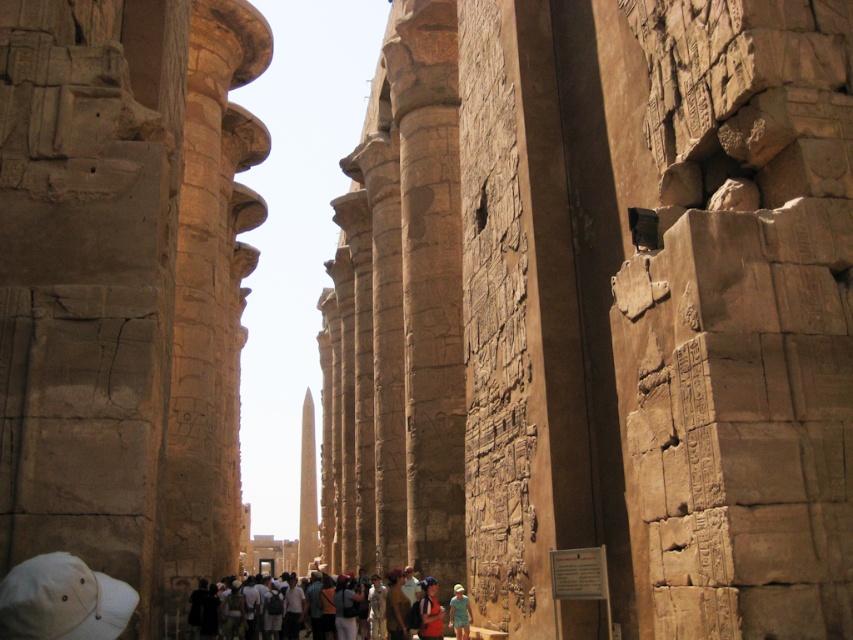
You are standing inside the ancient Egyptian temple and want to know how far the point at coordinates (x=613, y=573) is from you. Can you determine the distance?

The point at coordinates (x=613, y=573) is 179.67 feet away from the viewer.

You are standing inside an ancient Egyptian temple and looking up at the towering columns. There is a point marked at coordinates [601,310]. Based on the scene description, what object or feature does this point most likely correspond to?

The point at coordinates [601,310] corresponds to the beige stone wall at center.

You are an archaeologist examining the temple layout. You notice two points marked on your map at coordinates point (454, 586) and point (466, 600). Based on the temple structure, which point is closer to the entrance of the temple?

Point (466, 600) is closer to the entrance because it is in front of point (454, 586), which is behind it.